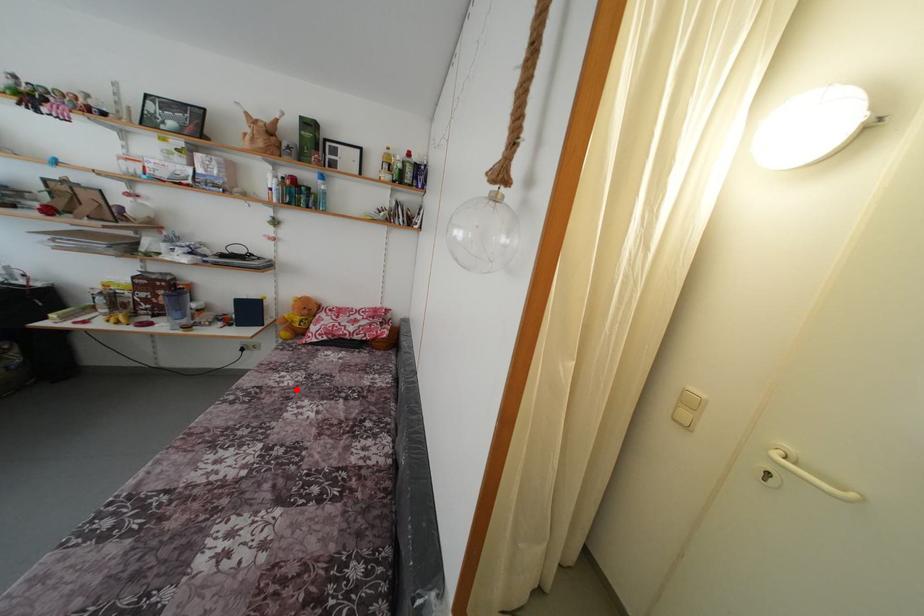
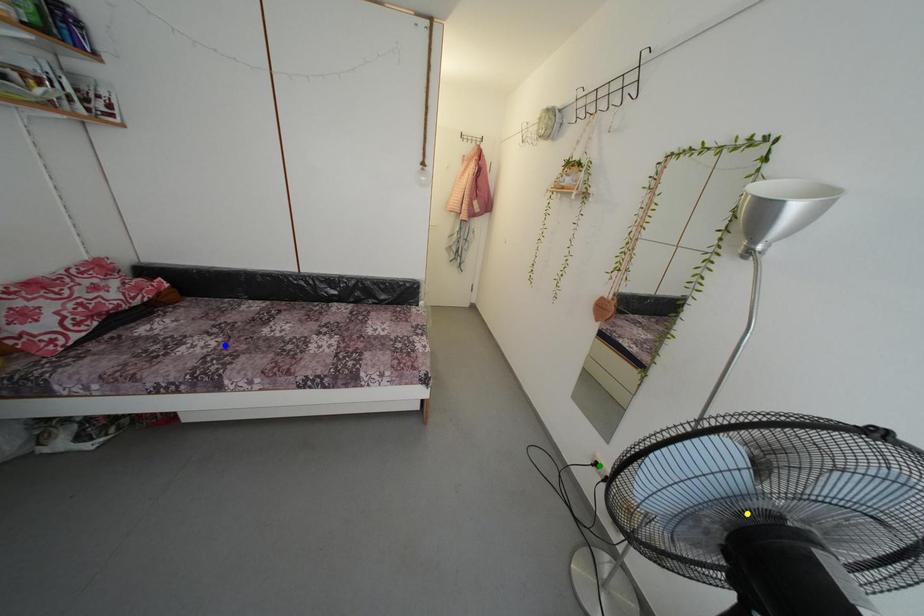
Question: I am providing you with two images of the same scene from different viewpoints. A red point is marked on the first image. You are given multiple points on the second image. Which spot in image 2 lines up with the point in image 1?

Choices:
 (A) yellow point
 (B) blue point
 (C) green point

Answer: (B)